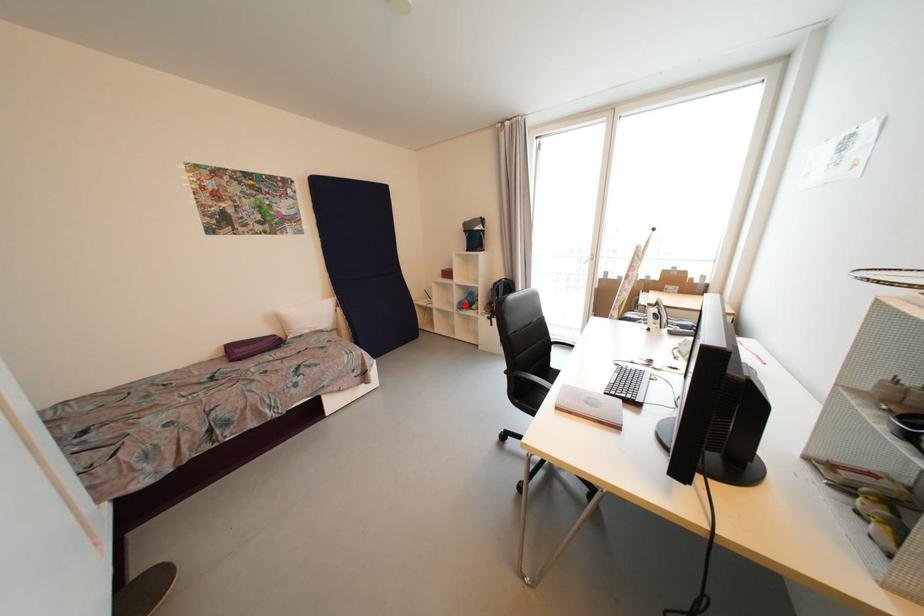
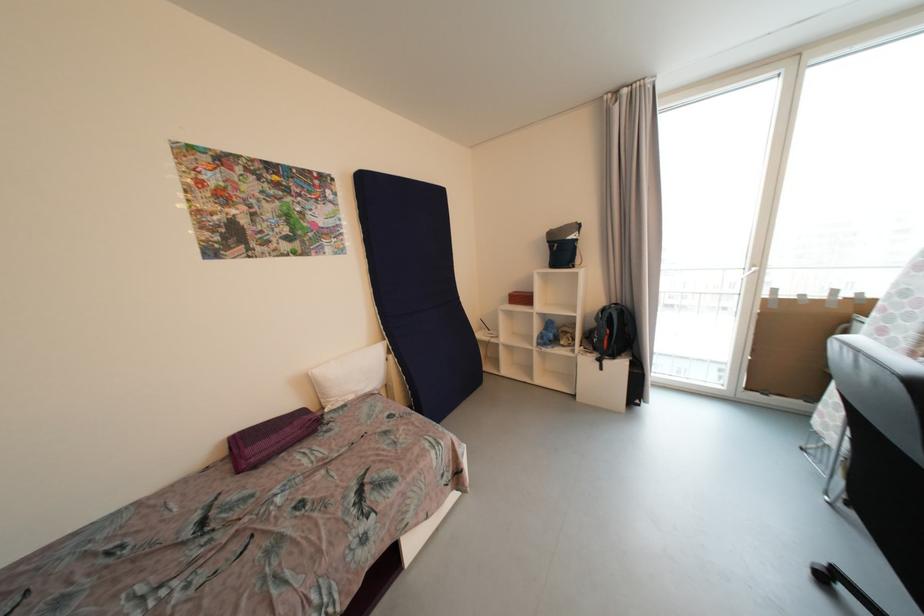
Question: I am providing you with two images of the same scene from different viewpoints. Image1 has a red point marked. In image2, the corresponding 3D location appears at what relative position? Reply with the corresponding letter.

Choices:
 (A) Closer
 (B) Farther

Answer: (B)